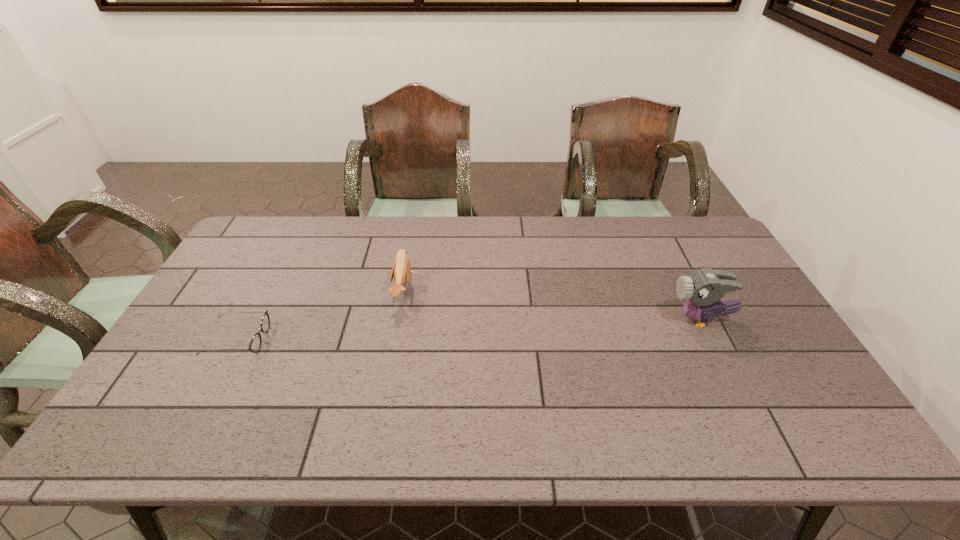
I want to click on free space located 0.290m through the lenses of the leftmost object, so click(372, 339).

Identify the location of object located in the left edge section of the desktop. The image size is (960, 540). (255, 344).

Image resolution: width=960 pixels, height=540 pixels. In order to click on object that is at the right edge in this screenshot , I will do `click(703, 288)`.

This screenshot has height=540, width=960. In the image, there is a desktop. Identify the location of vacant space at the far edge. (318, 225).

In the image, there is a desktop. Identify the location of vacant space at the near edge. (299, 417).

Where is `free space at the left edge of the desktop`? This screenshot has height=540, width=960. free space at the left edge of the desktop is located at coordinates (210, 366).

Locate an element on the screen. The width and height of the screenshot is (960, 540). free space at the right edge is located at coordinates (796, 387).

Locate an element on the screen. This screenshot has width=960, height=540. empty space between the leftmost object and the second shortest object is located at coordinates (321, 315).

At what (x,y) coordinates should I click in order to perform the action: click on empty space that is in between the second object from right to left and the rightmost object. Please return your answer as a coordinate pair (x, y). The height and width of the screenshot is (540, 960). Looking at the image, I should click on (552, 305).

I want to click on unoccupied area between the left bird and the taller bird, so click(x=552, y=305).